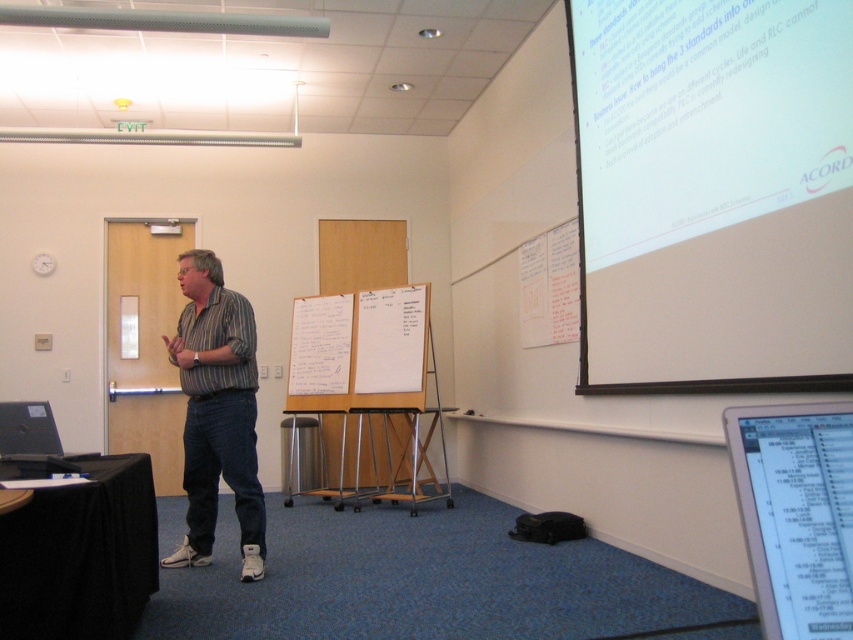
Which of these two, striped cotton shirt at center or white paperboard at center, stands shorter?

With less height is white paperboard at center.

Does point (186, 515) lie behind point (389, 305)?

That is False.

Identify the location of striped cotton shirt at center. The image size is (853, 640). (218, 412).

Find the location of a particular element. The height and width of the screenshot is (640, 853). striped cotton shirt at center is located at coordinates pos(218,412).

Between white matte projection screen at upper right and striped cotton shirt at center, which one is positioned lower?

striped cotton shirt at center

Which is above, white matte projection screen at upper right or striped cotton shirt at center?

white matte projection screen at upper right is higher up.

Is point (622, 24) positioned in front of point (183, 317)?

Yes, point (622, 24) is in front of point (183, 317).

Where is `white matte projection screen at upper right`? white matte projection screen at upper right is located at coordinates (712, 193).

Between white matte projection screen at upper right and black glossy screen at lower right, which one appears on the left side from the viewer's perspective?

black glossy screen at lower right

What do you see at coordinates (712, 193) in the screenshot? I see `white matte projection screen at upper right` at bounding box center [712, 193].

At what (x,y) coordinates should I click in order to perform the action: click on white matte projection screen at upper right. Please return your answer as a coordinate pair (x, y). The height and width of the screenshot is (640, 853). Looking at the image, I should click on (712, 193).